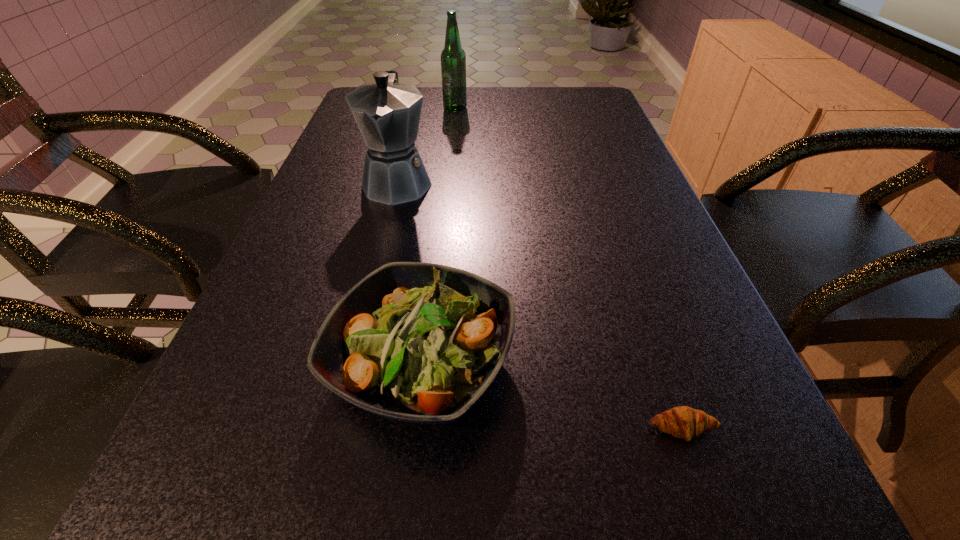
Image resolution: width=960 pixels, height=540 pixels. In order to click on free spot between the beer bottle and the second shortest object in this screenshot , I will do `click(439, 235)`.

At what (x,y) coordinates should I click in order to perform the action: click on free area in between the shortest object and the second shortest object. Please return your answer as a coordinate pair (x, y). Looking at the image, I should click on (552, 395).

You are a GUI agent. You are given a task and a screenshot of the screen. Output one action in this format:
    pyautogui.click(x=<x>, y=<y>)
    Task: Click on the free space that is in between the shortest object and the coffeepot
    Image resolution: width=960 pixels, height=540 pixels.
    Given the screenshot: What is the action you would take?
    pyautogui.click(x=540, y=305)

You are a GUI agent. You are given a task and a screenshot of the screen. Output one action in this format:
    pyautogui.click(x=<x>, y=<y>)
    Task: Click on the empty space that is in between the beer bottle and the third nearest object
    This screenshot has width=960, height=540.
    Given the screenshot: What is the action you would take?
    [426, 145]

Where is `vacant region between the beer bottle and the salad plate`? vacant region between the beer bottle and the salad plate is located at coordinates (439, 235).

Where is `vacant area that lies between the salad plate and the beer bottle`? This screenshot has height=540, width=960. vacant area that lies between the salad plate and the beer bottle is located at coordinates (439, 235).

Where is `free area in between the pastry and the coffeepot`? Image resolution: width=960 pixels, height=540 pixels. free area in between the pastry and the coffeepot is located at coordinates (540, 305).

Find the location of a particular element. This screenshot has height=540, width=960. object that is the closest to the third tallest object is located at coordinates (684, 422).

You are a GUI agent. You are given a task and a screenshot of the screen. Output one action in this format:
    pyautogui.click(x=<x>, y=<y>)
    Task: Click on the closest object to the rightmost object
    This screenshot has width=960, height=540.
    Given the screenshot: What is the action you would take?
    pyautogui.click(x=417, y=342)

The image size is (960, 540). Identify the location of vacant space that satisfies the following two spatial constraints: 1. at the spout of the coffeepot; 2. on the right side of the third tallest object. (353, 362).